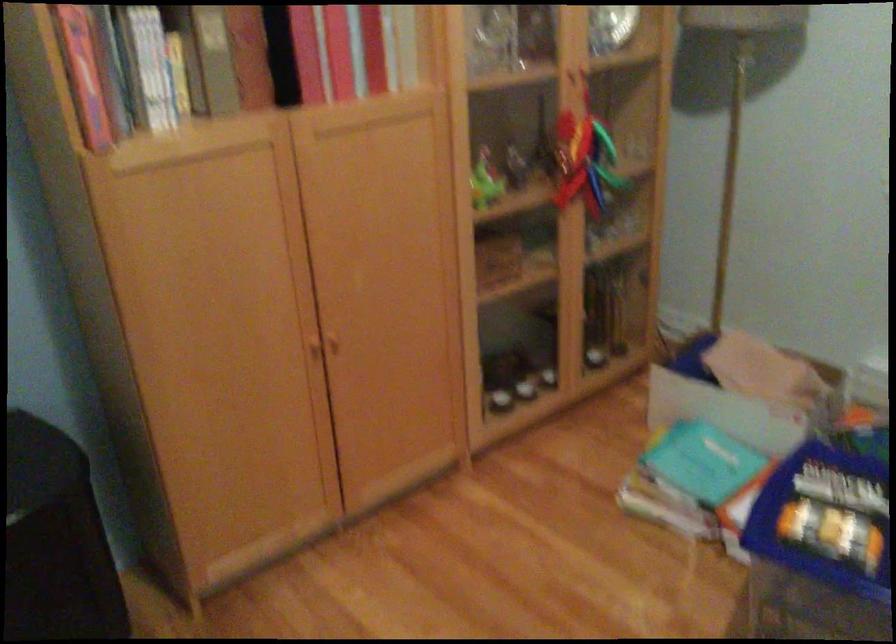
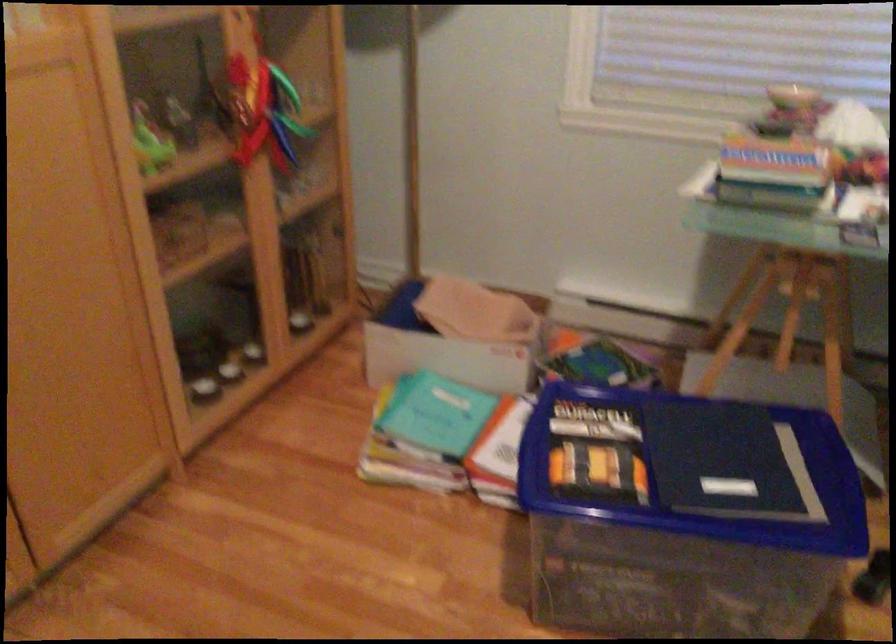
Question: The camera is either moving clockwise (left) or counter-clockwise (right) around the object. The first image is from the beginning of the video and the second image is from the end. Is the camera moving left or right when shooting the video?

Choices:
 (A) Left
 (B) Right

Answer: (A)